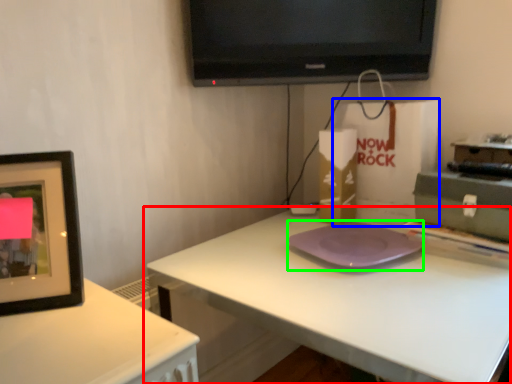
Question: Estimate the real-world distances between objects in this image. Which object is farther from table (highlighted by a red box), paper bag (highlighted by a blue box) or pad (highlighted by a green box)?

Choices:
 (A) paper bag
 (B) pad

Answer: (A)